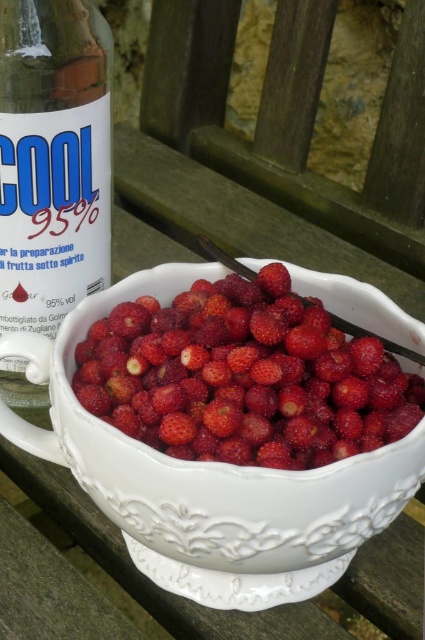
You are standing in the rustic outdoor setting with the wooden bench. You want to place a small vase exactly where the white porcelain bowl at center is currently located. Is this position available?

The position of the white porcelain bowl at center is at point (198, 476), so yes, you can place the small vase there since the coordinates are available.

You are a photographer trying to capture the shiny red strawberries at center. Based on the coordinates provided, where should you position your camera to ensure the strawberries are in the center of your shot?

The shiny red strawberries at center are located at coordinates point (243, 378), so position your camera to aim directly at that point to center them in your shot.

Where are the shiny red strawberries at center located in the image?

The shiny red strawberries at center are located at point coordinates of (243, 378).